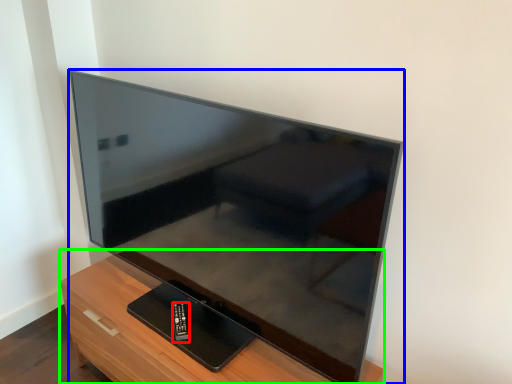
Question: Considering the real-world distances, which object is closest to control (highlighted by a red box)? television (highlighted by a blue box) or furniture (highlighted by a green box).

Choices:
 (A) television
 (B) furniture

Answer: (B)